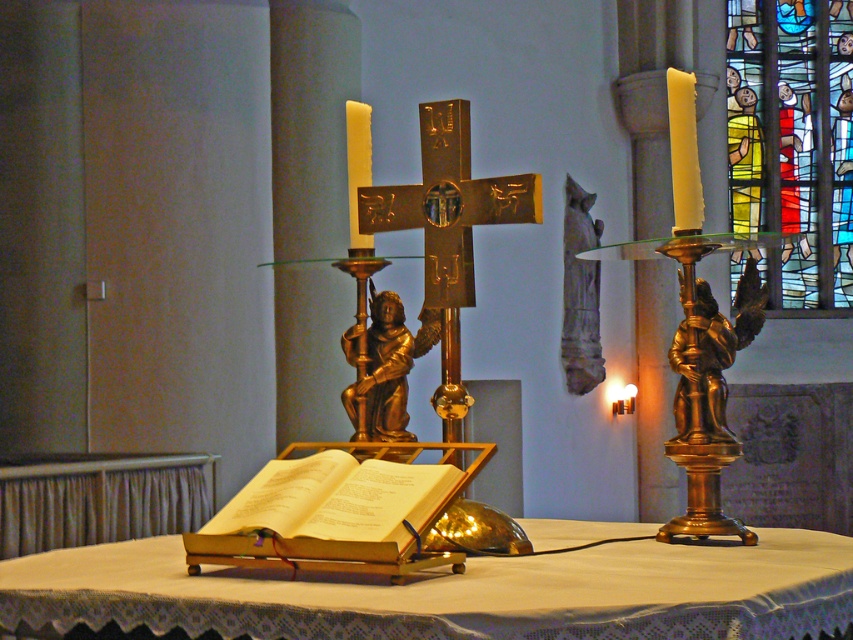
Based on the coordinates provided, where is the gold polished angel statue at right located in the image?

The gold polished angel statue at right is located at the coordinates point (695, 381).

You are standing in the church and want to place a small religious artifact on the gold textured table at center. Based on the table coordinates provided, where exactly should you place it?

The gold textured table at center is located at coordinates point [450,593], so you should place the artifact there.

You are standing in the church and looking at the table with the open book. There are two points marked on the table surface. Which point is closer to you, point (572, 582) or point (668, 115)?

Point (572, 582) is closer to you than point (668, 115).